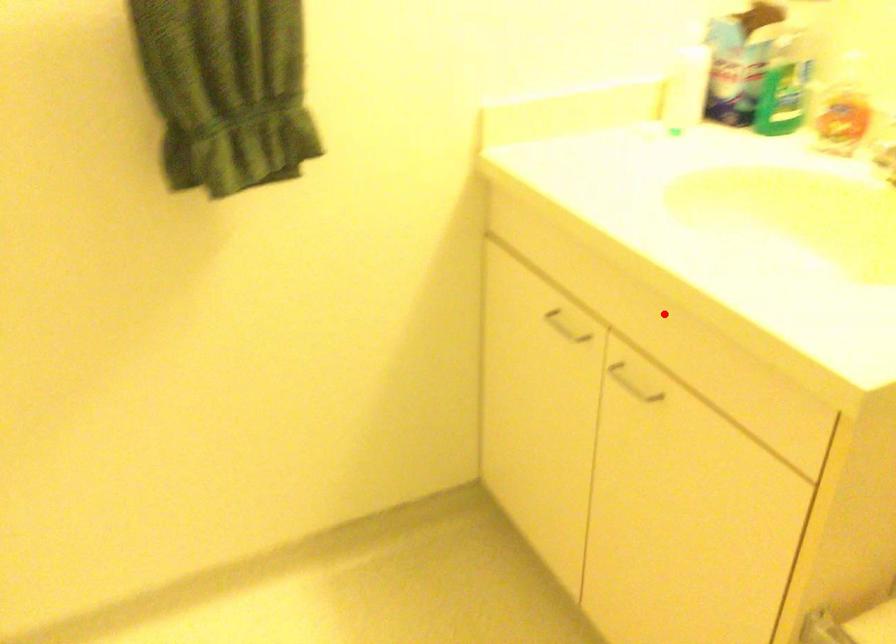
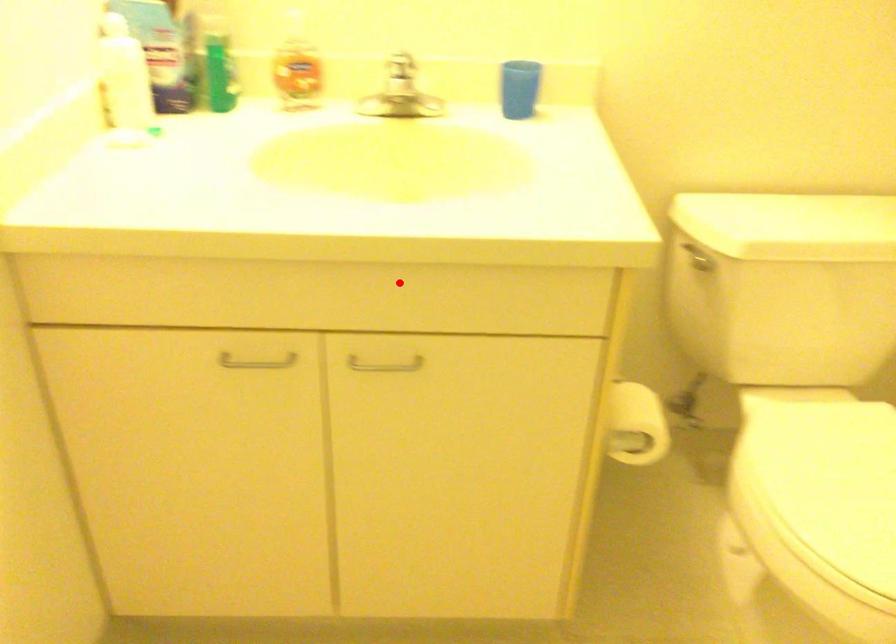
I am providing you with two images of the same scene from different viewpoints. A red point is marked on the first image and another point is marked on the second image. Does the point marked in image1 correspond to the same location as the one in image2?

Yes